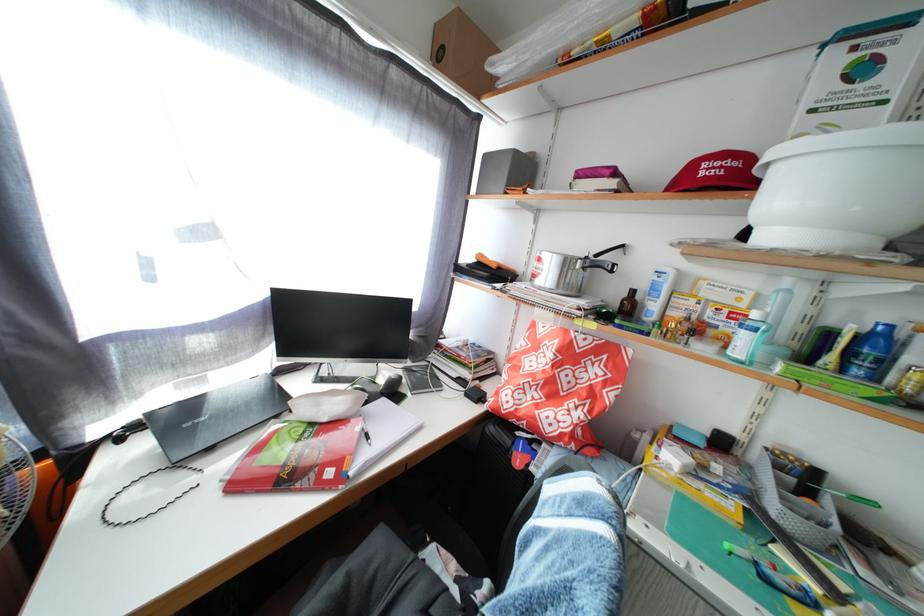
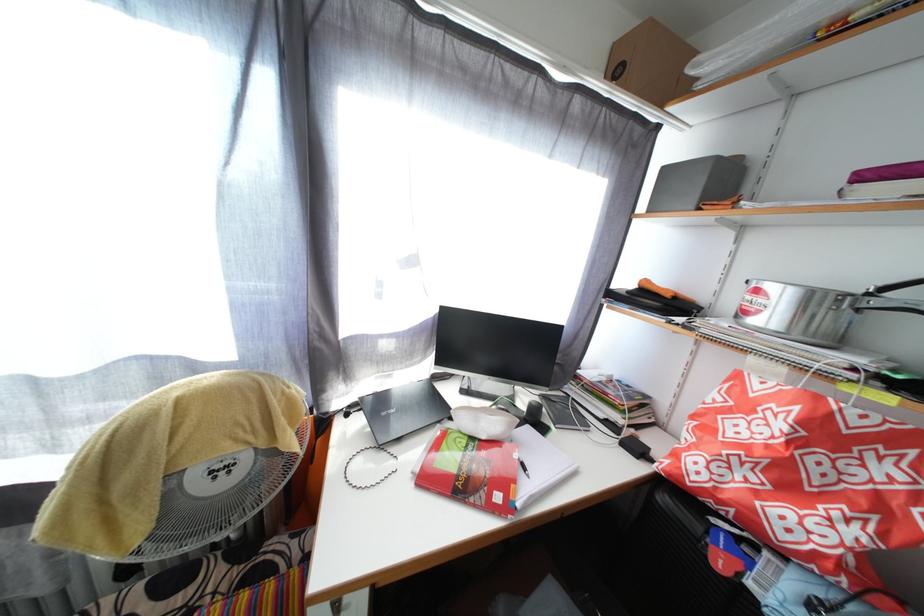
Question: In a continuous first-person perspective shot, in which direction is the camera moving?

Choices:
 (A) Left
 (B) Right
 (C) Forward
 (D) Backward

Answer: (A)